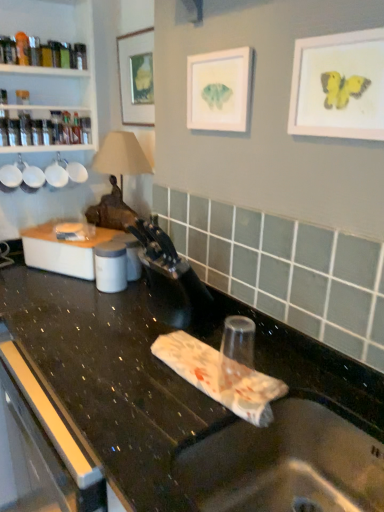
Find the location of a particular element. vacant space to the left of black plastic faucet at center is located at coordinates (103, 319).